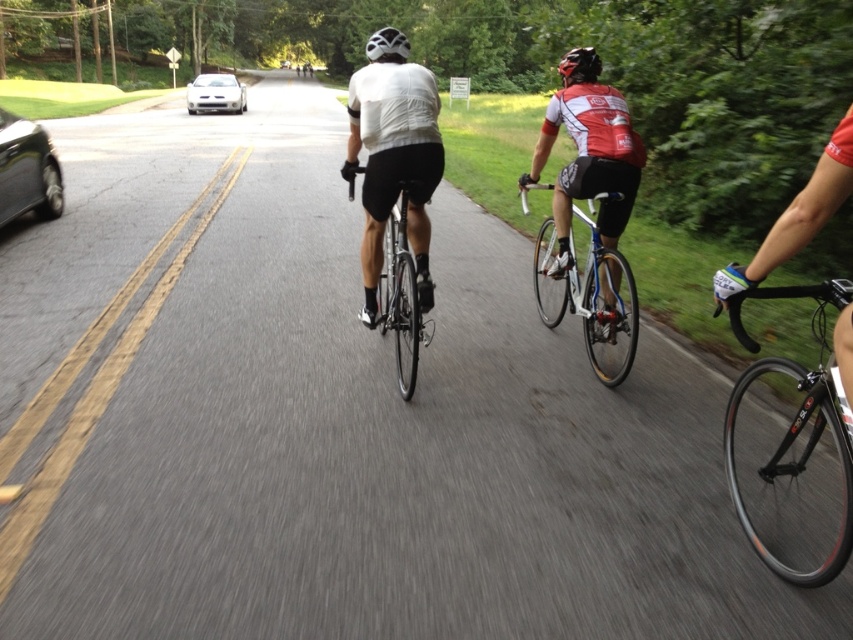
Between black glossy bicycle at right and white glossy sedan at upper center, which one appears on the right side from the viewer's perspective?

black glossy bicycle at right

Does black glossy bicycle at right have a larger size compared to white glossy sedan at upper center?

No.

Locate an element on the screen. The height and width of the screenshot is (640, 853). black glossy bicycle at right is located at coordinates (793, 429).

The height and width of the screenshot is (640, 853). What are the coordinates of `black glossy bicycle at right` in the screenshot? It's located at (793, 429).

Does white matte jersey at center appear under matte white helmet at center?

Yes, white matte jersey at center is below matte white helmet at center.

Between point (408, 168) and point (381, 28), which one is positioned in front?

Point (408, 168) is in front.

Locate an element on the screen. The width and height of the screenshot is (853, 640). white matte jersey at center is located at coordinates (393, 154).

Does white glossy sedan at upper center have a larger size compared to black matte helmet at upper center?

Correct, white glossy sedan at upper center is larger in size than black matte helmet at upper center.

Is white glossy sedan at upper center further to the viewer compared to black matte helmet at upper center?

Yes, it is behind black matte helmet at upper center.

Find the location of a particular element. This screenshot has width=853, height=640. white glossy sedan at upper center is located at coordinates (215, 93).